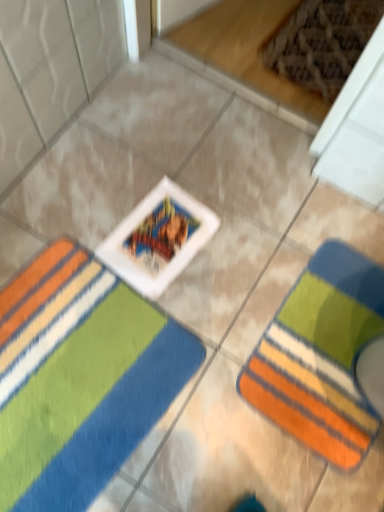
Question: Which direction should I rotate to look at multicolored plush towel at center, placed as the second towel when sorted from right to left, — up or down?

Choices:
 (A) down
 (B) up

Answer: (A)

Question: Is multicolored striped towel at lower right, which is the second towel from left to right, wider than multicolored plush towel at center, placed as the second towel when sorted from right to left?

Choices:
 (A) no
 (B) yes

Answer: (A)

Question: Is multicolored striped towel at lower right, which is the second towel from left to right, to the right of multicolored plush towel at center, which is the 1th towel in left-to-right order, from the viewer's perspective?

Choices:
 (A) no
 (B) yes

Answer: (B)

Question: Can you confirm if multicolored striped towel at lower right, which is the second towel from left to right, is thinner than multicolored plush towel at center, which is the 1th towel in left-to-right order?

Choices:
 (A) no
 (B) yes

Answer: (B)

Question: Is multicolored plush towel at center, which is the 1th towel in left-to-right order, completely or partially inside multicolored striped towel at lower right, which ranks as the first towel in right-to-left order?

Choices:
 (A) yes
 (B) no

Answer: (B)

Question: From a real-world perspective, is multicolored striped towel at lower right, which ranks as the first towel in right-to-left order, beneath multicolored plush towel at center, placed as the second towel when sorted from right to left?

Choices:
 (A) no
 (B) yes

Answer: (B)

Question: Considering the relative sizes of multicolored striped towel at lower right, which is the second towel from left to right, and multicolored plush towel at center, placed as the second towel when sorted from right to left, in the image provided, is multicolored striped towel at lower right, which is the second towel from left to right, taller than multicolored plush towel at center, placed as the second towel when sorted from right to left,?

Choices:
 (A) no
 (B) yes

Answer: (A)

Question: From the image's perspective, is multicolored plush towel at center, which is the 1th towel in left-to-right order, below multicolored striped towel at lower right, which ranks as the first towel in right-to-left order?

Choices:
 (A) no
 (B) yes

Answer: (B)

Question: From the image's perspective, is multicolored plush towel at center, placed as the second towel when sorted from right to left, on top of multicolored striped towel at lower right, which ranks as the first towel in right-to-left order?

Choices:
 (A) no
 (B) yes

Answer: (A)

Question: From a real-world perspective, is multicolored plush towel at center, placed as the second towel when sorted from right to left, below multicolored striped towel at lower right, which is the second towel from left to right?

Choices:
 (A) no
 (B) yes

Answer: (A)

Question: Does multicolored plush towel at center, placed as the second towel when sorted from right to left, have a greater height compared to multicolored striped towel at lower right, which is the second towel from left to right?

Choices:
 (A) yes
 (B) no

Answer: (A)

Question: From a real-world perspective, is multicolored plush towel at center, which is the 1th towel in left-to-right order, over multicolored striped towel at lower right, which is the second towel from left to right?

Choices:
 (A) yes
 (B) no

Answer: (A)

Question: Can you confirm if multicolored plush towel at center, which is the 1th towel in left-to-right order, is thinner than multicolored striped towel at lower right, which is the second towel from left to right?

Choices:
 (A) no
 (B) yes

Answer: (A)

Question: From a real-world perspective, is multicolored striped towel at lower right, which ranks as the first towel in right-to-left order, above or below multicolored plush towel at center, placed as the second towel when sorted from right to left?

Choices:
 (A) below
 (B) above

Answer: (A)